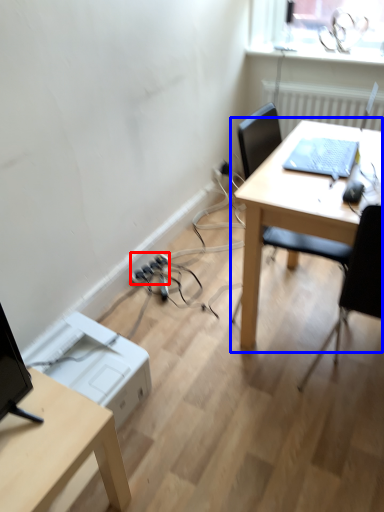
Question: Among these objects, which one is farthest to the camera, extension cord (highlighted by a red box) or table (highlighted by a blue box)?

Choices:
 (A) extension cord
 (B) table

Answer: (A)